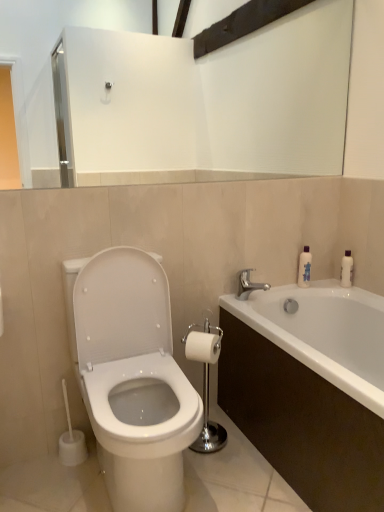
At what (x,y) coordinates should I click in order to perform the action: click on free space to the left of silver metallic faucet at upper right. Please return your answer as a coordinate pair (x, y). The image size is (384, 512). Looking at the image, I should click on (229, 300).